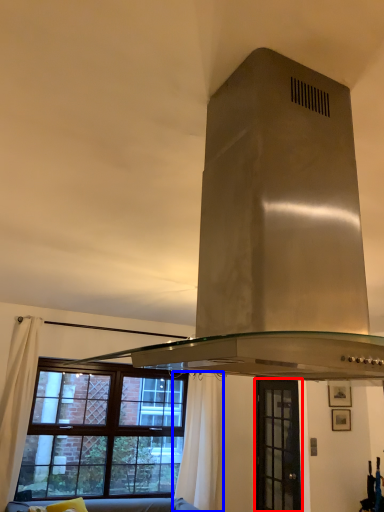
Question: Among these objects, which one is farthest to the camera, window (highlighted by a red box) or curtain (highlighted by a blue box)?

Choices:
 (A) window
 (B) curtain

Answer: (B)